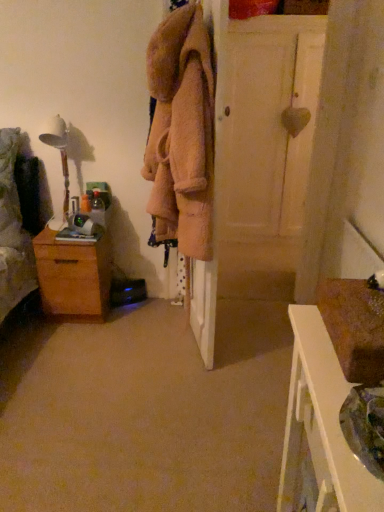
Question: In terms of height, does fuzzy beige coat at center look taller or shorter compared to white matte door at center?

Choices:
 (A) short
 (B) tall

Answer: (A)

Question: Visually, is fuzzy beige coat at center positioned to the left or to the right of white matte door at center?

Choices:
 (A) right
 (B) left

Answer: (B)

Question: Which object is the closest to the white wood nightstand at lower right?

Choices:
 (A) white matte door at center
 (B) wooden chest of drawers at left
 (C) fuzzy beige coat at center
 (D) wooden table lamp at left

Answer: (C)

Question: Considering the real-world distances, which object is closest to the white wood nightstand at lower right?

Choices:
 (A) wooden table lamp at left
 (B) fuzzy beige coat at center
 (C) wooden chest of drawers at left
 (D) white matte door at center

Answer: (B)